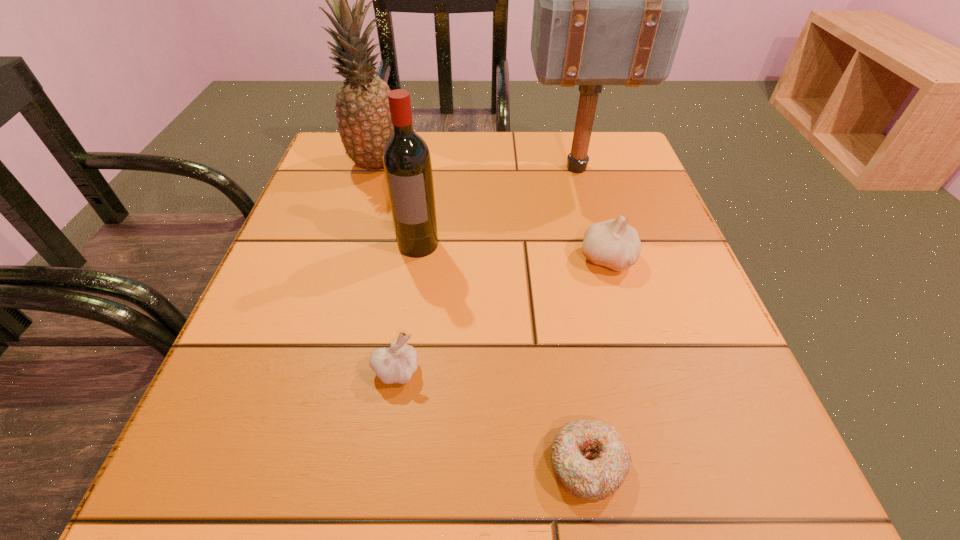
You are a GUI agent. You are given a task and a screenshot of the screen. Output one action in this format:
    pyautogui.click(x=<x>, y=<y>)
    Task: Click on the empty space between the taller garlic and the shortest object
    
    Given the screenshot: What is the action you would take?
    pyautogui.click(x=597, y=362)

Locate an element on the screen. The height and width of the screenshot is (540, 960). object that can be found as the closest to the pineapple is located at coordinates (407, 164).

This screenshot has width=960, height=540. Identify the location of object that stands as the third closest to the fourth shortest object. (610, 0).

Identify the location of free space that satisfies the following two spatial constraints: 1. on the back side of the right garlic; 2. on the striking surface of the mallet. This screenshot has height=540, width=960. (581, 168).

Find the location of a particular element. The width and height of the screenshot is (960, 540). free location that satisfies the following two spatial constraints: 1. on the striking surface of the mallet; 2. on the back side of the farther garlic is located at coordinates (603, 259).

The width and height of the screenshot is (960, 540). Identify the location of vacant point that satisfies the following two spatial constraints: 1. on the striking surface of the mallet; 2. on the back side of the taller garlic. (603, 259).